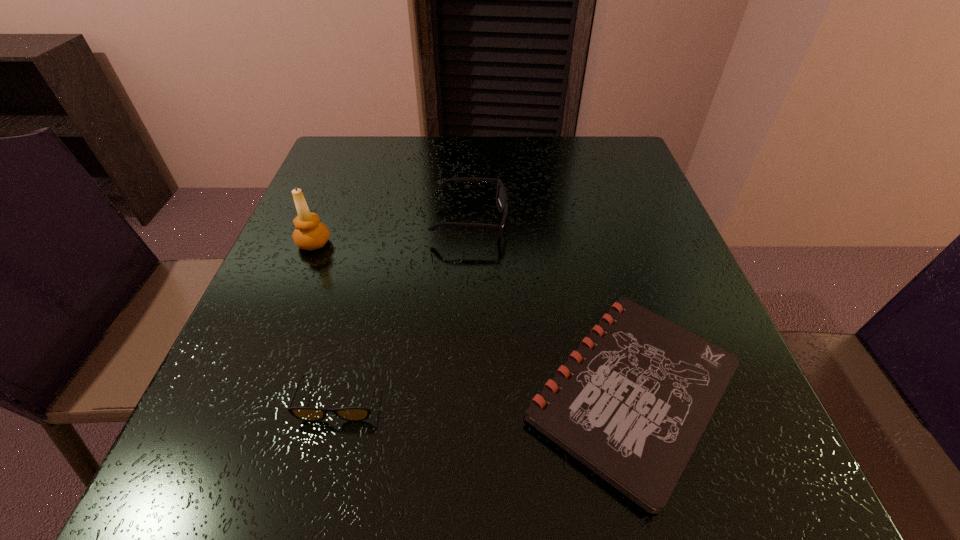
Image resolution: width=960 pixels, height=540 pixels. I want to click on free point located 0.050m on the front-facing side of the second shortest object, so click(x=325, y=457).

Identify the location of free spot located 0.360m on the back of the shortest object. pyautogui.click(x=577, y=190).

Find the location of a particular element. The width and height of the screenshot is (960, 540). object at the near edge is located at coordinates (640, 390).

Find the location of a particular element. The height and width of the screenshot is (540, 960). candle_holder that is at the left edge is located at coordinates (310, 234).

Image resolution: width=960 pixels, height=540 pixels. In order to click on sunglasses at the left edge in this screenshot , I will do `click(313, 414)`.

Where is `object that is at the right edge`? Image resolution: width=960 pixels, height=540 pixels. object that is at the right edge is located at coordinates (640, 390).

Where is `object located at the near right corner`? This screenshot has height=540, width=960. object located at the near right corner is located at coordinates (640, 390).

Locate an element on the screen. vacant space at the far edge of the desktop is located at coordinates (564, 155).

In the image, there is a desktop. Identify the location of vacant space at the near edge. The image size is (960, 540). (335, 452).

This screenshot has width=960, height=540. I want to click on vacant area at the left edge of the desktop, so click(x=348, y=198).